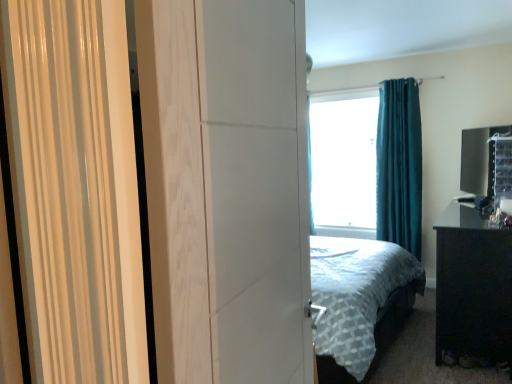
Find the location of a particular element. The height and width of the screenshot is (384, 512). transparent glass window screen at center is located at coordinates (344, 162).

What do you see at coordinates (227, 188) in the screenshot? I see `white matte screen door at center` at bounding box center [227, 188].

Describe the element at coordinates (472, 285) in the screenshot. I see `black glossy nightstand at right` at that location.

Where is `transparent glass window screen at center`? Image resolution: width=512 pixels, height=384 pixels. transparent glass window screen at center is located at coordinates (344, 162).

From a real-world perspective, which is physically above, black glossy nightstand at right or transparent glass window screen at center?

In real-world perspective, transparent glass window screen at center is above.

Between black glossy nightstand at right and transparent glass window screen at center, which one has less height?

black glossy nightstand at right is shorter.

From the image's perspective, does black glossy nightstand at right appear higher than transparent glass window screen at center?

No, from the image's perspective, black glossy nightstand at right is not on top of transparent glass window screen at center.

Does black glossy nightstand at right touch transparent glass window screen at center?

black glossy nightstand at right and transparent glass window screen at center are not in contact.

What's the angular difference between black glossy nightstand at right and white matte screen door at center's facing directions?

The facing directions of black glossy nightstand at right and white matte screen door at center are 174 degrees apart.

From the image's perspective, does black glossy nightstand at right appear lower than white matte screen door at center?

Correct, black glossy nightstand at right appears lower than white matte screen door at center in the image.

Considering the sizes of objects black glossy nightstand at right and white matte screen door at center in the image provided, who is thinner, black glossy nightstand at right or white matte screen door at center?

white matte screen door at center.

Looking at this image, is black glossy nightstand at right next to white matte screen door at center?

No, black glossy nightstand at right is not next to white matte screen door at center.

From a real-world perspective, is transparent glass window screen at center physically located above or below black glossy nightstand at right?

From a real-world perspective, transparent glass window screen at center is physically above black glossy nightstand at right.

Can you confirm if transparent glass window screen at center is smaller than black glossy nightstand at right?

Yes.

Is transparent glass window screen at center aimed at black glossy nightstand at right?

No, transparent glass window screen at center does not turn towards black glossy nightstand at right.

Considering the relative positions of transparent glass window screen at center and black glossy nightstand at right in the image provided, is transparent glass window screen at center to the right of black glossy nightstand at right from the viewer's perspective?

In fact, transparent glass window screen at center is to the left of black glossy nightstand at right.

Does white matte screen door at center contain transparent glass window screen at center?

No.

Looking at the image, does white matte screen door at center seem bigger or smaller compared to transparent glass window screen at center?

Clearly, white matte screen door at center is smaller in size than transparent glass window screen at center.

Is white matte screen door at center aimed at transparent glass window screen at center?

No, white matte screen door at center is not oriented towards transparent glass window screen at center.

Between white matte screen door at center and transparent glass window screen at center, which one has larger width?

With larger width is transparent glass window screen at center.

Does teal velvet curtain at upper right appear on the left side of transparent glass window screen at center?

In fact, teal velvet curtain at upper right is to the right of transparent glass window screen at center.

Can you confirm if teal velvet curtain at upper right is wider than transparent glass window screen at center?

In fact, teal velvet curtain at upper right might be narrower than transparent glass window screen at center.

Which is behind, point (386, 231) or point (346, 90)?

The point (346, 90) is behind.

Consider the image. Is teal velvet curtain at upper right further to camera compared to transparent glass window screen at center?

No, it is in front of transparent glass window screen at center.

Does black glossy nightstand at right touch teal velvet curtain at upper right?

No, black glossy nightstand at right is not making contact with teal velvet curtain at upper right.

What's the angular difference between black glossy nightstand at right and teal velvet curtain at upper right's facing directions?

black glossy nightstand at right and teal velvet curtain at upper right are facing 88.5 degrees away from each other.

From the image's perspective, between black glossy nightstand at right and teal velvet curtain at upper right, which one is located above?

From the image's view, teal velvet curtain at upper right is above.

Identify the location of nightstand that is in front of the teal velvet curtain at upper right. (472, 285).

Are teal velvet curtain at upper right and white matte screen door at center located far from each other?

teal velvet curtain at upper right is positioned a significant distance from white matte screen door at center.

Locate an element on the screen. screen door to the left of teal velvet curtain at upper right is located at coordinates (227, 188).

Is teal velvet curtain at upper right aimed at white matte screen door at center?

Yes, teal velvet curtain at upper right is aimed at white matte screen door at center.

Measure the distance from teal velvet curtain at upper right to white matte screen door at center.

The distance of teal velvet curtain at upper right from white matte screen door at center is 3.44 meters.

Find the location of `window screen on the left of black glossy nightstand at right`. window screen on the left of black glossy nightstand at right is located at coordinates (344, 162).

The image size is (512, 384). I want to click on nightstand located on the right of white matte screen door at center, so click(472, 285).

Estimate the real-world distances between objects in this image. Which object is closer to transparent glass window screen at center, white matte screen door at center or black glossy nightstand at right?

black glossy nightstand at right lies closer to transparent glass window screen at center than the other object.

Looking at the image, which one is located further to transparent glass window screen at center, white matte screen door at center or teal velvet curtain at upper right?

white matte screen door at center.

Considering their positions, is white matte screen door at center positioned further to black glossy nightstand at right than teal velvet curtain at upper right?

The object further to black glossy nightstand at right is white matte screen door at center.

Looking at the image, which one is located further to teal velvet curtain at upper right, white matte screen door at center or black glossy nightstand at right?

The object further to teal velvet curtain at upper right is white matte screen door at center.

From the image, which object appears to be farther from transparent glass window screen at center, teal velvet curtain at upper right or white matte screen door at center?

A: white matte screen door at center lies further to transparent glass window screen at center than the other object.

Considering their positions, is teal velvet curtain at upper right positioned further to transparent glass window screen at center than black glossy nightstand at right?

The object further to transparent glass window screen at center is black glossy nightstand at right.

Which object lies further to the anchor point teal velvet curtain at upper right, white matte screen door at center or transparent glass window screen at center?

Based on the image, white matte screen door at center appears to be further to teal velvet curtain at upper right.

Looking at the image, which one is located closer to transparent glass window screen at center, black glossy nightstand at right or teal velvet curtain at upper right?

Based on the image, teal velvet curtain at upper right appears to be nearer to transparent glass window screen at center.

Identify the location of curtain positioned between black glossy nightstand at right and transparent glass window screen at center from near to far. Image resolution: width=512 pixels, height=384 pixels. (399, 165).

Locate an element on the screen. Image resolution: width=512 pixels, height=384 pixels. nightstand between white matte screen door at center and transparent glass window screen at center along the z-axis is located at coordinates (472, 285).

Image resolution: width=512 pixels, height=384 pixels. Find the location of `curtain positioned between white matte screen door at center and transparent glass window screen at center from near to far`. curtain positioned between white matte screen door at center and transparent glass window screen at center from near to far is located at coordinates (399, 165).

Where is `nightstand between white matte screen door at center and teal velvet curtain at upper right along the z-axis`? The image size is (512, 384). nightstand between white matte screen door at center and teal velvet curtain at upper right along the z-axis is located at coordinates (472, 285).